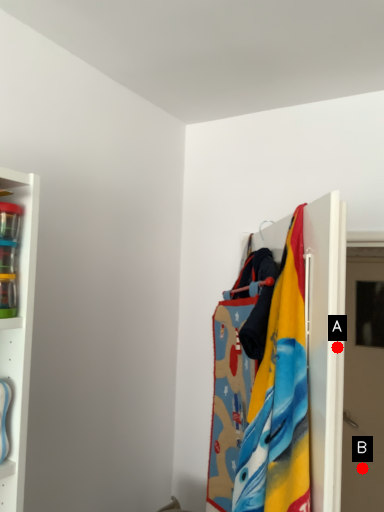
Question: Two points are circled on the image, labeled by A and B beside each circle. Which of the following is the farthest from the observer?

Choices:
 (A) A is further
 (B) B is further

Answer: (B)